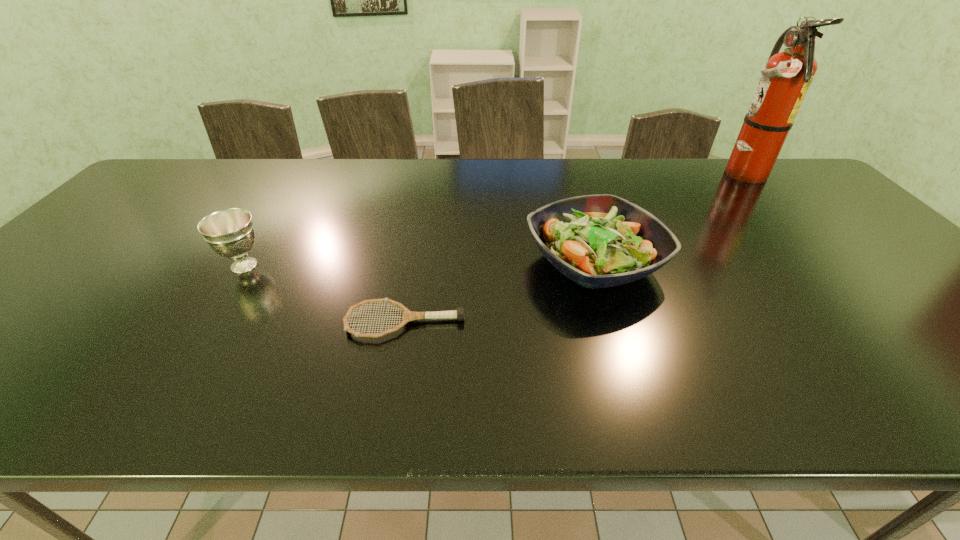
You are a GUI agent. You are given a task and a screenshot of the screen. Output one action in this format:
    pyautogui.click(x=<x>, y=<y>)
    Task: Click on the vacant space that satisfies the following two spatial constraints: 1. on the back side of the chalice; 2. on the left side of the salad plate
    The image size is (960, 540).
    Given the screenshot: What is the action you would take?
    pyautogui.click(x=247, y=262)

Image resolution: width=960 pixels, height=540 pixels. I want to click on free spot that satisfies the following two spatial constraints: 1. from the nozzle of the tallest object; 2. on the front side of the chalice, so click(x=825, y=266).